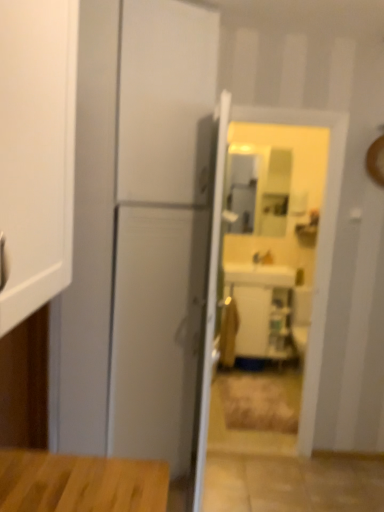
Question: Is white glossy sink at center closer to the viewer compared to white glossy door at center?

Choices:
 (A) no
 (B) yes

Answer: (A)

Question: Is white glossy door at center located within white glossy sink at center?

Choices:
 (A) no
 (B) yes

Answer: (A)

Question: From the image's perspective, is white glossy sink at center beneath white glossy door at center?

Choices:
 (A) yes
 (B) no

Answer: (B)

Question: Considering the relative sizes of white glossy sink at center and white glossy door at center in the image provided, is white glossy sink at center taller than white glossy door at center?

Choices:
 (A) no
 (B) yes

Answer: (A)

Question: Is white glossy sink at center positioned behind white glossy door at center?

Choices:
 (A) no
 (B) yes

Answer: (B)

Question: From a real-world perspective, relative to white glossy sink at center, is white glossy door at center vertically above or below?

Choices:
 (A) below
 (B) above

Answer: (B)

Question: From the image's perspective, is white glossy door at center positioned above or below white glossy sink at center?

Choices:
 (A) below
 (B) above

Answer: (A)

Question: Choose the correct answer: Is white glossy door at center inside white glossy sink at center or outside it?

Choices:
 (A) inside
 (B) outside

Answer: (B)

Question: Looking at their shapes, would you say white glossy door at center is wider or thinner than white glossy sink at center?

Choices:
 (A) thin
 (B) wide

Answer: (A)

Question: Is white glossy sink at center in front of or behind white glossy door at center in the image?

Choices:
 (A) front
 (B) behind

Answer: (B)

Question: Considering the positions of point (281, 267) and point (226, 115), is point (281, 267) closer or farther from the camera than point (226, 115)?

Choices:
 (A) closer
 (B) farther

Answer: (B)

Question: Is white glossy sink at center wider or thinner than white glossy door at center?

Choices:
 (A) thin
 (B) wide

Answer: (B)

Question: From a real-world perspective, relative to white glossy door at center, is white glossy sink at center vertically above or below?

Choices:
 (A) above
 (B) below

Answer: (B)

Question: Does point (221, 155) appear closer or farther from the camera than point (264, 263)?

Choices:
 (A) farther
 (B) closer

Answer: (B)

Question: In terms of height, does white glossy door at center look taller or shorter compared to matte silver faucet at center?

Choices:
 (A) tall
 (B) short

Answer: (A)